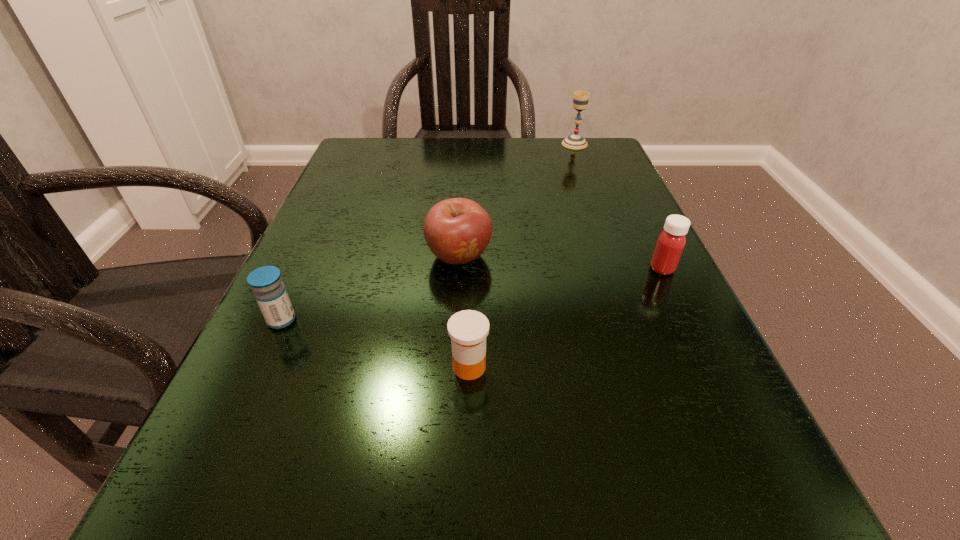
Identify the location of the tallest object. This screenshot has height=540, width=960. (580, 100).

I want to click on the farthest object, so click(x=580, y=100).

Image resolution: width=960 pixels, height=540 pixels. What are the coordinates of `the farthest medicine` in the screenshot? It's located at (670, 244).

I want to click on the rightmost medicine, so click(x=670, y=244).

The image size is (960, 540). In order to click on apple in this screenshot , I will do `click(457, 230)`.

This screenshot has width=960, height=540. I want to click on the leftmost object, so click(x=270, y=293).

I want to click on the second nearest medicine, so click(270, 293).

Image resolution: width=960 pixels, height=540 pixels. I want to click on the second medicine from left to right, so click(x=468, y=329).

You are a GUI agent. You are given a task and a screenshot of the screen. Output one action in this format:
    pyautogui.click(x=<x>, y=<y>)
    Task: Click on the nearest medicine
    The image size is (960, 540).
    Given the screenshot: What is the action you would take?
    pyautogui.click(x=468, y=329)

Where is `vacant space located on the left of the farthest object`? Image resolution: width=960 pixels, height=540 pixels. vacant space located on the left of the farthest object is located at coordinates (451, 144).